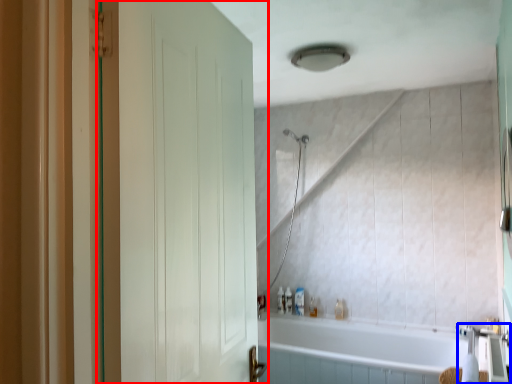
Question: Which object appears closest to the camera in this image, door (highlighted by a red box) or faucet (highlighted by a blue box)?

Choices:
 (A) door
 (B) faucet

Answer: (A)